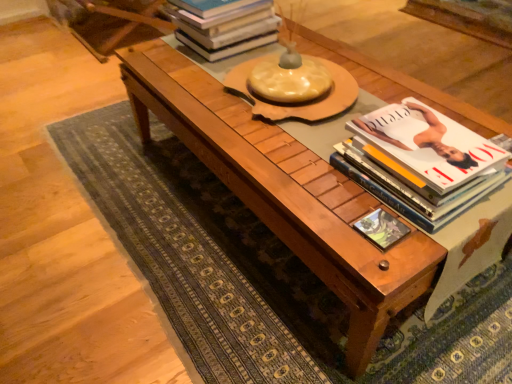
At what (x,y) coordinates should I click in order to perform the action: click on vacant area that is in front of hardcover books at upper center, acting as the second book starting from the front. Please return your answer as a coordinate pair (x, y). Looking at the image, I should click on (189, 83).